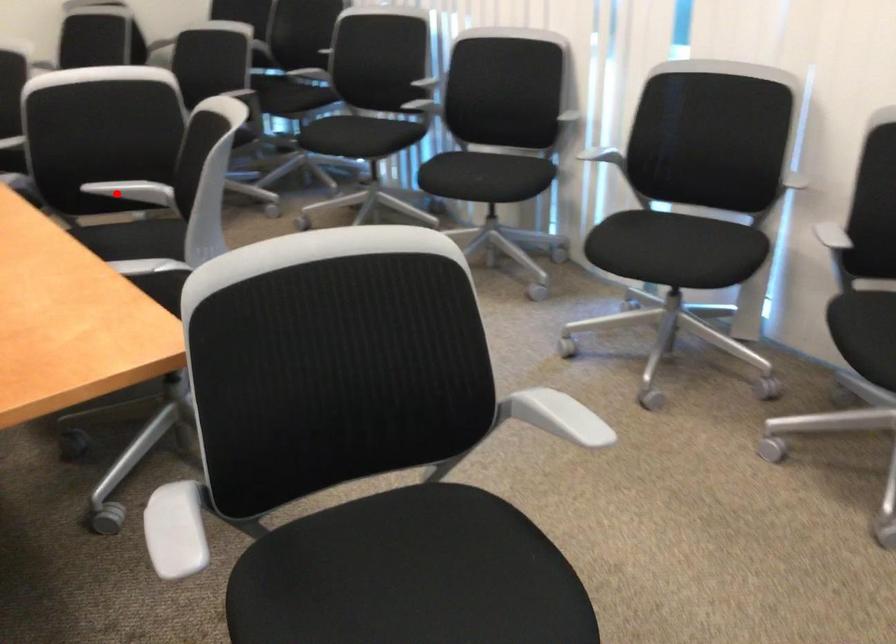
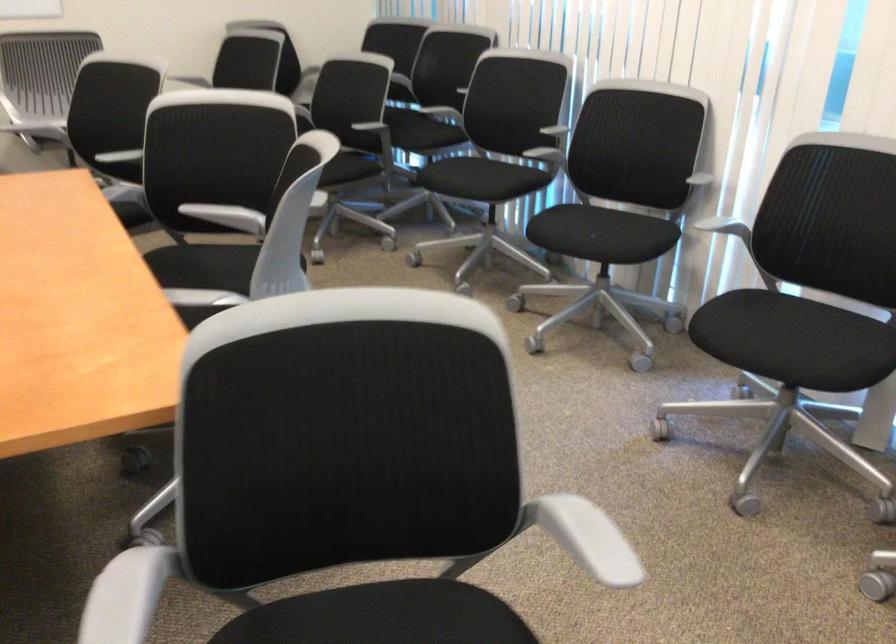
Where in the second image is the point corresponding to the highlighted location from the first image?

(208, 212)